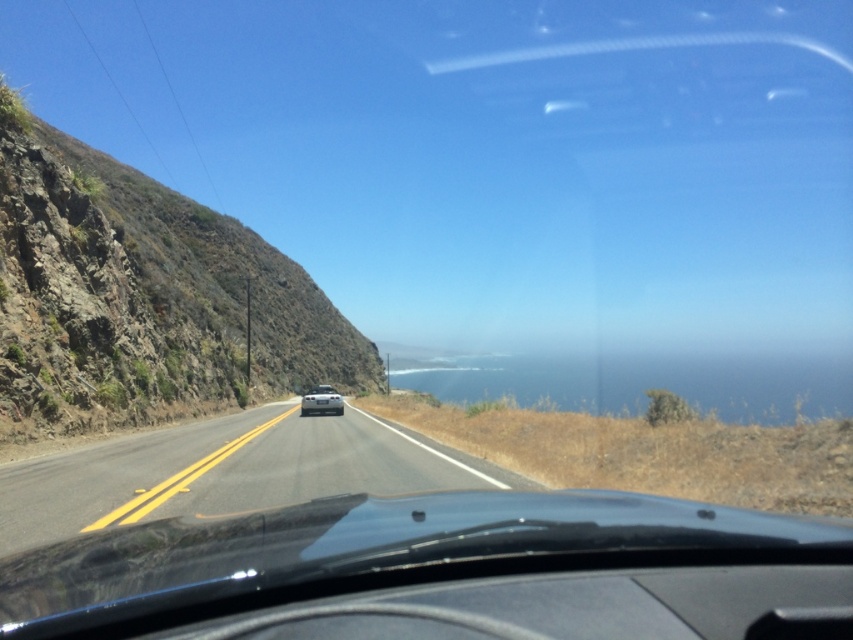
You are driving along this coastal road and need to pull over to the side to take a photo. Which side of the road would give you more space to safely park without blocking the road? The rugged rock cliff at left or the dry grass at right?

The rugged rock cliff at left might be wider than dry grass at right, so parking on the rugged rock cliff at left side would provide more space and be safer without blocking the road.

You are driving a car and see the black asphalt road at center and the silver metallic car at center ahead. Which object is positioned to the right side from your perspective?

The black asphalt road at center is to the right of the silver metallic car at center.